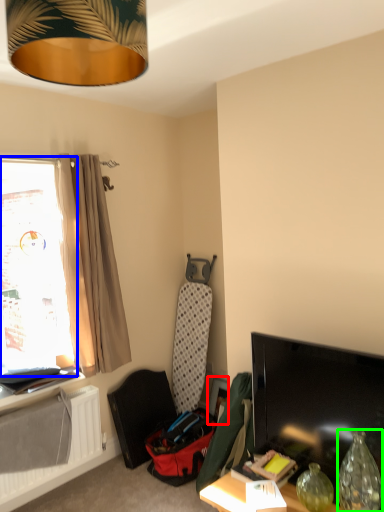
Question: Which object is the farthest from picture frame (highlighted by a red box)? Choose among these: window (highlighted by a blue box) or vase (highlighted by a green box).

Choices:
 (A) window
 (B) vase

Answer: (A)